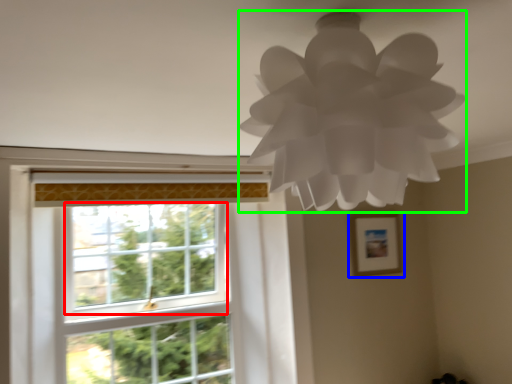
Question: Estimate the real-world distances between objects in this image. Which object is farther from window screen (highlighted by a red box), picture frame (highlighted by a blue box) or lamp (highlighted by a green box)?

Choices:
 (A) picture frame
 (B) lamp

Answer: (B)